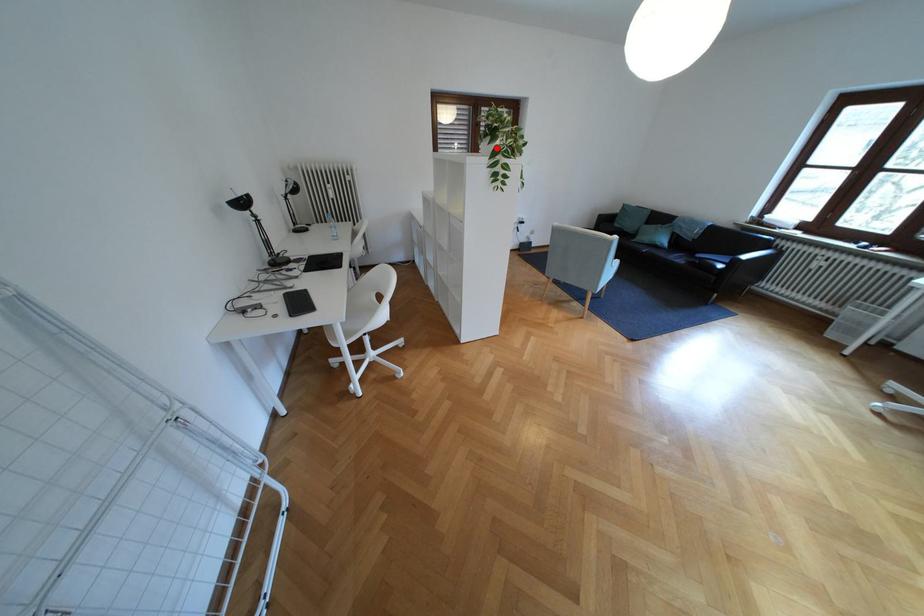
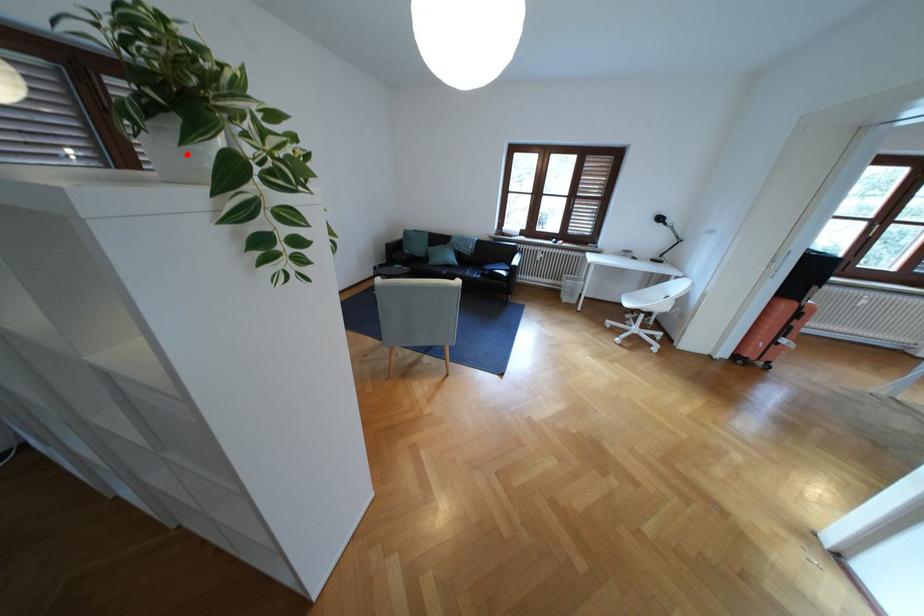
I am providing you with two images of the same scene from different viewpoints. A red point is marked on the first image and another point is marked on the second image. Is the marked point in image1 the same physical position as the marked point in image2?

Yes